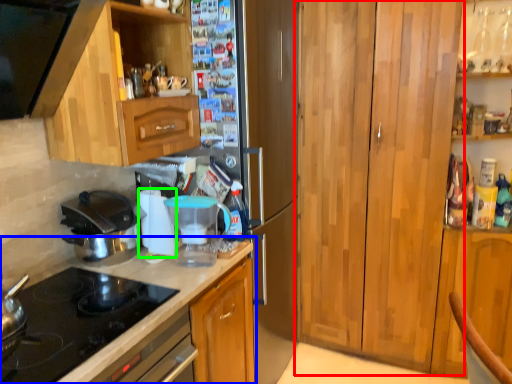
Question: Estimate the real-world distances between objects in this image. Which object is farther from cabinetry (highlighted by a red box), countertop (highlighted by a blue box) or appliance (highlighted by a green box)?

Choices:
 (A) countertop
 (B) appliance

Answer: (B)